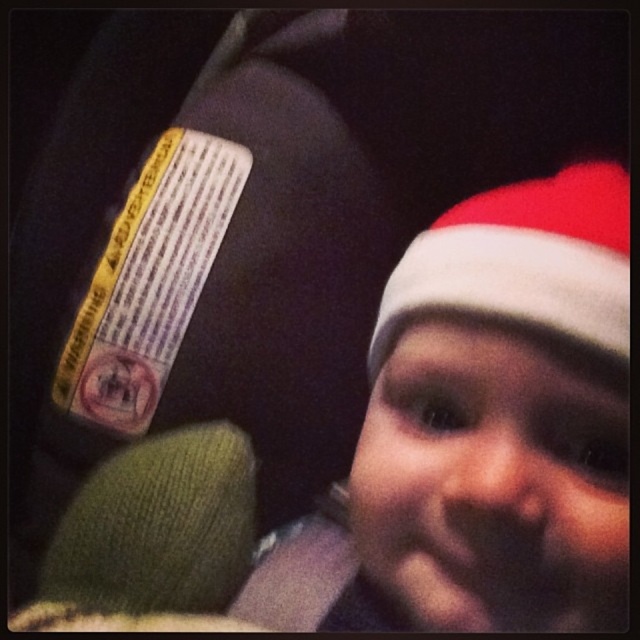
Question: Is white knit hat at upper right behind red velvet santa hat at upper right?

Choices:
 (A) yes
 (B) no

Answer: (B)

Question: Which point is closer to the camera taking this photo?

Choices:
 (A) (188, 556)
 (B) (515, 221)

Answer: (B)

Question: Is white knit hat at upper right further to the viewer compared to red velvet santa hat at upper right?

Choices:
 (A) yes
 (B) no

Answer: (B)

Question: Among these objects, which one is farthest from the camera?

Choices:
 (A) red velvet santa hat at upper right
 (B) white knit hat at upper right

Answer: (A)

Question: Can you confirm if white knit hat at upper right is positioned above red velvet santa hat at upper right?

Choices:
 (A) yes
 (B) no

Answer: (B)